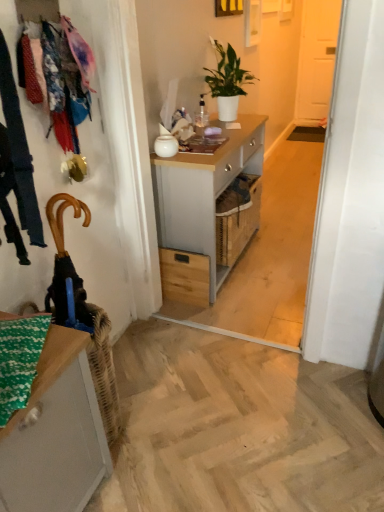
Question: Can you confirm if matte gray cabinet at lower left is positioned to the right of light gray wood desk at center?

Choices:
 (A) no
 (B) yes

Answer: (A)

Question: From the image's perspective, is matte gray cabinet at lower left located beneath light gray wood desk at center?

Choices:
 (A) yes
 (B) no

Answer: (A)

Question: Is matte gray cabinet at lower left closer to the viewer compared to light gray wood desk at center?

Choices:
 (A) no
 (B) yes

Answer: (B)

Question: Is matte gray cabinet at lower left not inside light gray wood desk at center?

Choices:
 (A) no
 (B) yes

Answer: (B)

Question: Does matte gray cabinet at lower left have a smaller size compared to light gray wood desk at center?

Choices:
 (A) no
 (B) yes

Answer: (B)

Question: Visually, is light gray wood desk at center positioned to the left or to the right of white matte door at upper right?

Choices:
 (A) left
 (B) right

Answer: (A)

Question: Which is correct: light gray wood desk at center is inside white matte door at upper right, or outside of it?

Choices:
 (A) inside
 (B) outside

Answer: (B)

Question: Is light gray wood desk at center bigger or smaller than white matte door at upper right?

Choices:
 (A) big
 (B) small

Answer: (A)

Question: Relative to white matte door at upper right, is light gray wood desk at center in front or behind?

Choices:
 (A) front
 (B) behind

Answer: (A)

Question: Is point (87, 400) positioned closer to the camera than point (188, 263)?

Choices:
 (A) farther
 (B) closer

Answer: (B)

Question: In terms of size, does matte gray cabinet at lower left appear bigger or smaller than wooden drawer at center?

Choices:
 (A) small
 (B) big

Answer: (B)

Question: Is matte gray cabinet at lower left spatially inside wooden drawer at center, or outside of it?

Choices:
 (A) inside
 (B) outside

Answer: (B)

Question: Based on their positions, is matte gray cabinet at lower left located to the left or right of wooden drawer at center?

Choices:
 (A) right
 (B) left

Answer: (B)

Question: Is matte gray cabinet at lower left spatially inside white glossy vase at center, or outside of it?

Choices:
 (A) inside
 (B) outside

Answer: (B)

Question: Based on their positions, is matte gray cabinet at lower left located to the left or right of white glossy vase at center?

Choices:
 (A) right
 (B) left

Answer: (B)